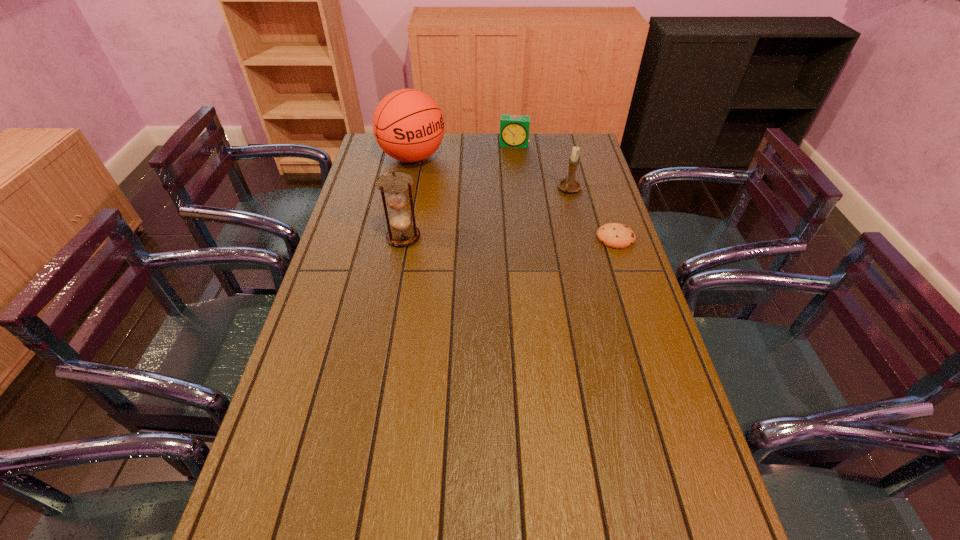
I want to click on hourglass, so click(x=402, y=233).

Where is `the rightmost object`? The height and width of the screenshot is (540, 960). the rightmost object is located at coordinates (614, 235).

Where is `the shortest object`? Image resolution: width=960 pixels, height=540 pixels. the shortest object is located at coordinates (614, 235).

At what (x,y) coordinates should I click in order to perform the action: click on basketball. Please return your answer as a coordinate pair (x, y). This screenshot has width=960, height=540. Looking at the image, I should click on (408, 125).

You are a GUI agent. You are given a task and a screenshot of the screen. Output one action in this format:
    pyautogui.click(x=<x>, y=<y>)
    Task: Click on the candle holder
    
    Given the screenshot: What is the action you would take?
    (570, 184)

In order to click on the third tallest object in this screenshot , I will do `click(570, 184)`.

You are a GUI agent. You are given a task and a screenshot of the screen. Output one action in this format:
    pyautogui.click(x=<x>, y=<y>)
    Task: Click on the third object from right to left
    This screenshot has height=540, width=960.
    Given the screenshot: What is the action you would take?
    pyautogui.click(x=514, y=129)

Where is `the fourth tallest object`? the fourth tallest object is located at coordinates (514, 129).

Image resolution: width=960 pixels, height=540 pixels. In order to click on vacant space positioned 0.240m on the back of the hourglass in this screenshot , I will do `click(413, 185)`.

The image size is (960, 540). I want to click on blank space located 0.250m on the back of the shortest object, so click(597, 183).